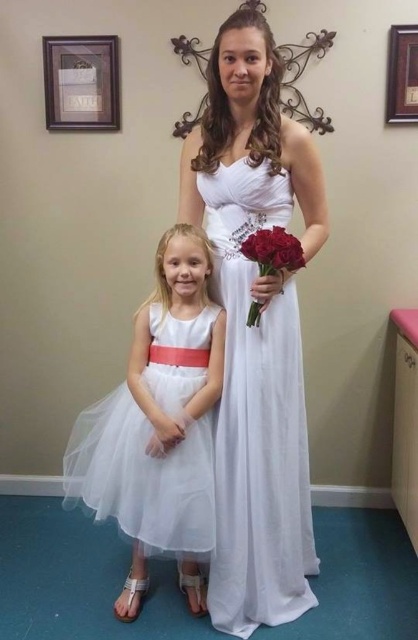
Question: Which point is farther from the camera taking this photo?

Choices:
 (A) (188, 604)
 (B) (250, 237)
 (C) (252, 552)
 (D) (262, 237)

Answer: (A)

Question: Is white tulle dress at center smaller than matte red roses at center?

Choices:
 (A) no
 (B) yes

Answer: (A)

Question: Is white satin dress at center in front of matte red roses at center?

Choices:
 (A) yes
 (B) no

Answer: (B)

Question: Which of the following is the closest to the observer?

Choices:
 (A) red velvet roses at center
 (B) white tulle dress at center

Answer: (A)

Question: Among these points, which one is farthest from the camera?

Choices:
 (A) (280, 230)
 (B) (282, 253)
 (C) (160, 545)
 (D) (229, 605)

Answer: (D)

Question: Is white satin dress at center wider than white tulle dress at center?

Choices:
 (A) no
 (B) yes

Answer: (A)